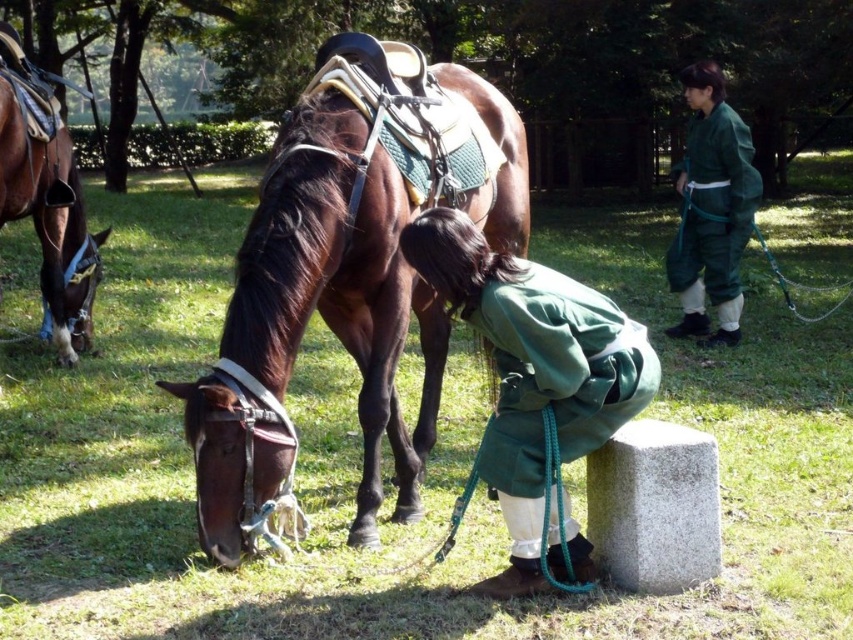
You are a visitor in the park and see the shiny brown horse at center and the green soft robe at center. Which object is taller?

The shiny brown horse at center is much taller than the green soft robe at center.